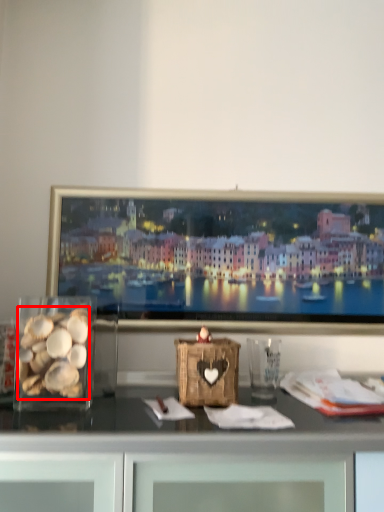
Question: Where is food (annotated by the red box) located in relation to glass vase in the image?

Choices:
 (A) right
 (B) left

Answer: (B)